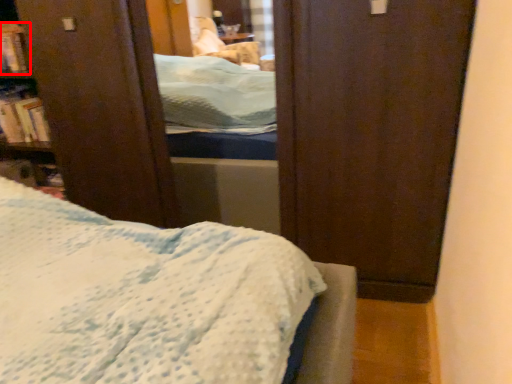
Question: From the image's perspective, considering the relative positions of book (annotated by the red box) and book in the image provided, where is book (annotated by the red box) located with respect to the staircase?

Choices:
 (A) below
 (B) above

Answer: (B)